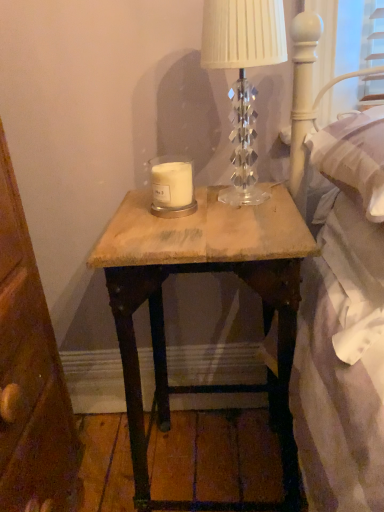
Identify the location of free space above wooden nightstand at center (from a real-world perspective). (203, 207).